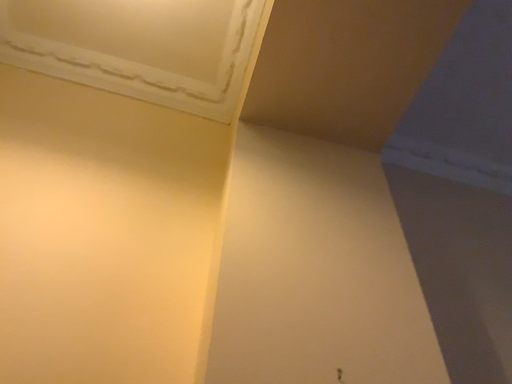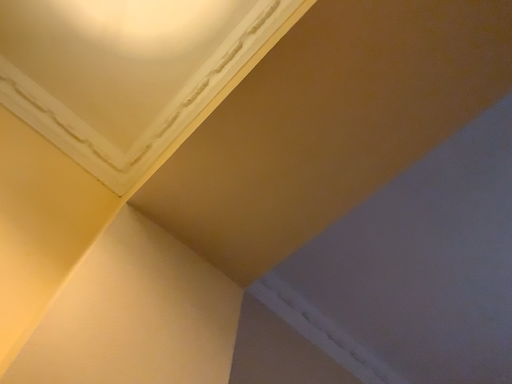
Question: Which way did the camera rotate in the video?

Choices:
 (A) rotated downward
 (B) rotated upward

Answer: (B)